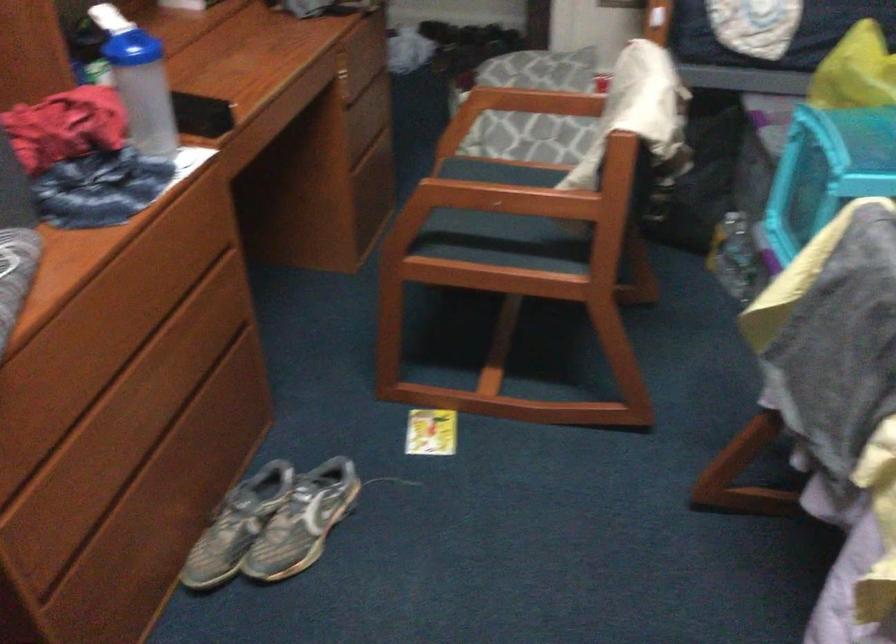
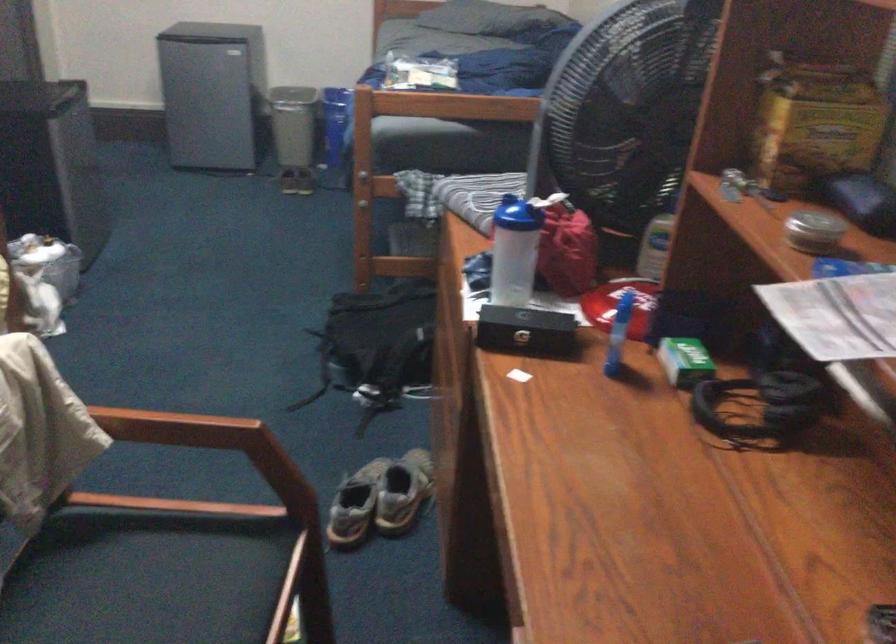
Where in the second image is the point corresponding to the point at 319,512 from the first image?

(355, 505)